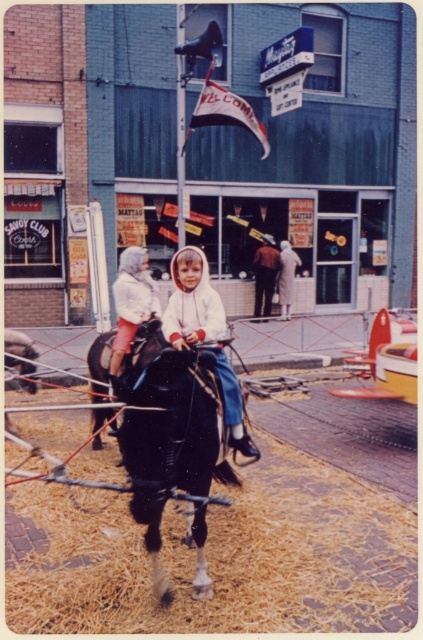
Question: Estimate the real-world distances between objects in this image. Which object is farther from the white cotton jacket at center?

Choices:
 (A) black glossy horse at center
 (B) white clothed figure at center

Answer: (B)

Question: Can you confirm if brown straw at lower center is bigger than white clothed figure at center?

Choices:
 (A) yes
 (B) no

Answer: (A)

Question: Can you confirm if black glossy horse at center is bigger than white clothed figure at center?

Choices:
 (A) no
 (B) yes

Answer: (B)

Question: Estimate the real-world distances between objects in this image. Which object is closer to the white clothed figure at center?

Choices:
 (A) brown straw at lower center
 (B) dark brown leather jacket at center

Answer: (B)

Question: Is white matte jacket at center to the right of white clothed figure at center from the viewer's perspective?

Choices:
 (A) no
 (B) yes

Answer: (A)

Question: Which of the following is the closest to the observer?

Choices:
 (A) black glossy horse at center
 (B) dark brown leather jacket at center
 (C) brown straw at lower center
 (D) white cotton jacket at center

Answer: (A)